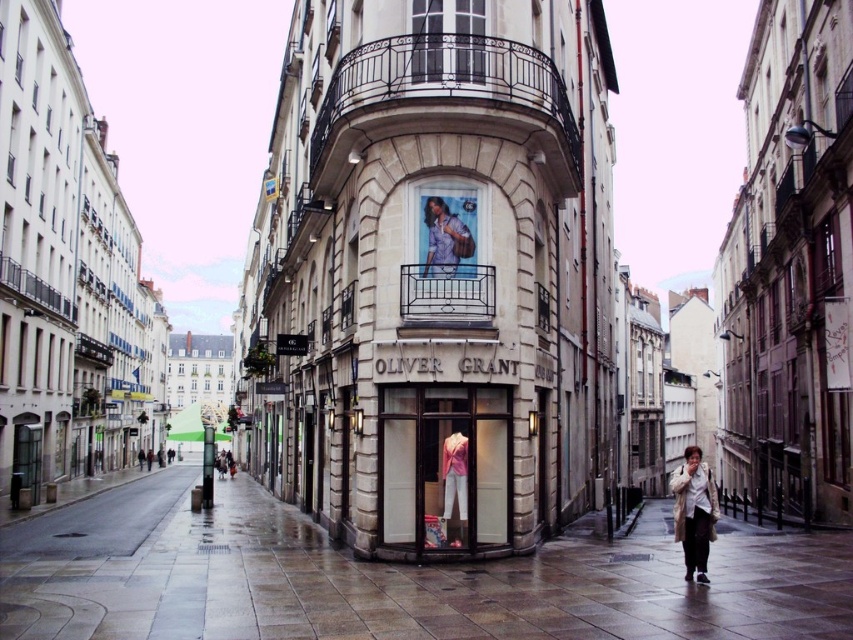
Question: Does dark brown wrought iron balcony at upper center appear on the right side of pink fabric dress at center?

Choices:
 (A) no
 (B) yes

Answer: (A)

Question: Does dark gray wrought iron balcony at center have a smaller size compared to dark brown leather jacket at lower center?

Choices:
 (A) no
 (B) yes

Answer: (B)

Question: Which is farther from the beige wool coat at lower right?

Choices:
 (A) dark gray wrought iron balcony at center
 (B) pink fabric mannequin at center

Answer: (A)

Question: Which object appears closest to the camera in this image?

Choices:
 (A) metallic balcony at upper left
 (B) dark gray wrought iron balcony at center

Answer: (B)

Question: Among these points, which one is farthest from the camera?

Choices:
 (A) (444, 472)
 (B) (453, 269)

Answer: (B)

Question: Where is pink fabric mannequin at center located in relation to dark brown wrought iron balcony at upper center in the image?

Choices:
 (A) below
 (B) above

Answer: (A)